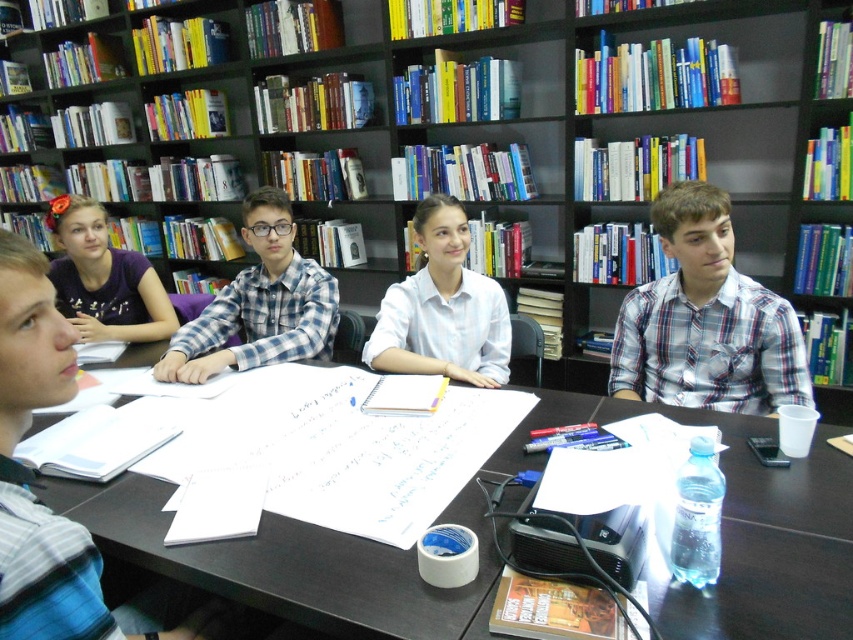
Does black wood table at center have a greater width compared to purple fabric shirt at upper left?

Correct, the width of black wood table at center exceeds that of purple fabric shirt at upper left.

Is black wood table at center taller than purple fabric shirt at upper left?

In fact, black wood table at center may be shorter than purple fabric shirt at upper left.

Does point (392, 604) come closer to viewer compared to point (120, 272)?

That is True.

This screenshot has height=640, width=853. Find the location of `black wood table at center`. black wood table at center is located at coordinates (291, 564).

Describe the element at coordinates (526, 134) in the screenshot. I see `wooden bookshelf at upper center` at that location.

Can you confirm if wooden bookshelf at upper center is positioned below black wood table at center?

Incorrect, wooden bookshelf at upper center is not positioned below black wood table at center.

Find the location of a particular element. The height and width of the screenshot is (640, 853). wooden bookshelf at upper center is located at coordinates (526, 134).

Locate an element on the screen. The image size is (853, 640). wooden bookshelf at upper center is located at coordinates pyautogui.click(x=526, y=134).

Does white shirt at center have a larger size compared to purple fabric shirt at upper left?

Incorrect, white shirt at center is not larger than purple fabric shirt at upper left.

You are a GUI agent. You are given a task and a screenshot of the screen. Output one action in this format:
    pyautogui.click(x=<x>, y=<y>)
    Task: Click on the white shirt at center
    The image size is (853, 640).
    Given the screenshot: What is the action you would take?
    pyautogui.click(x=442, y=308)

Find the location of a particular element. The image size is (853, 640). white shirt at center is located at coordinates (442, 308).